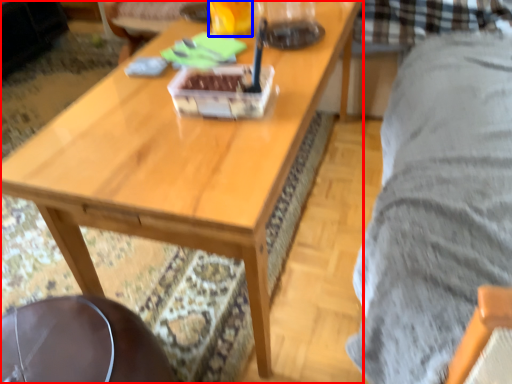
Question: Among these objects, which one is nearest to the camera, coffee table (highlighted by a red box) or beverage (highlighted by a blue box)?

Choices:
 (A) coffee table
 (B) beverage

Answer: (A)